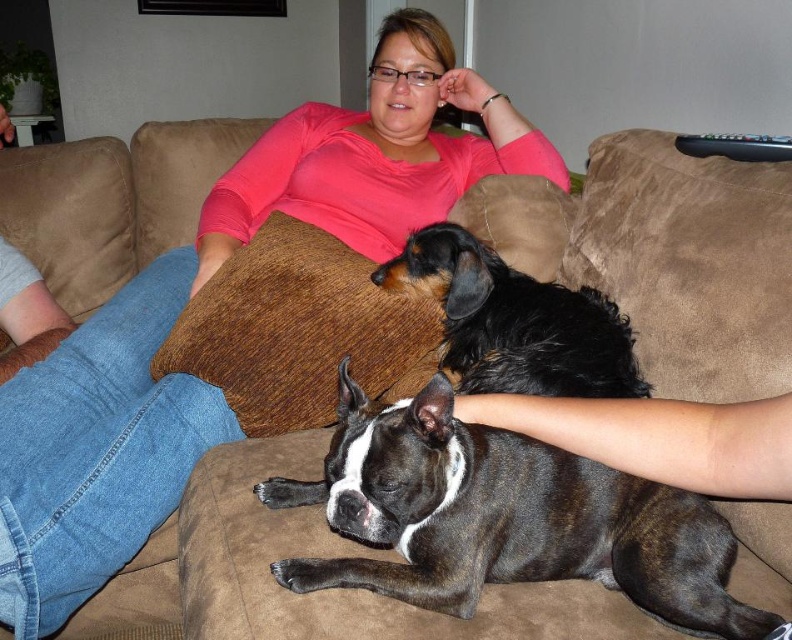
Between brindle fur dog at center and black curly fur dog at center, which one appears on the left side from the viewer's perspective?

Positioned to the left is brindle fur dog at center.

Is brindle fur dog at center positioned before black curly fur dog at center?

That is True.

Locate an element on the screen. This screenshot has height=640, width=792. brindle fur dog at center is located at coordinates (505, 516).